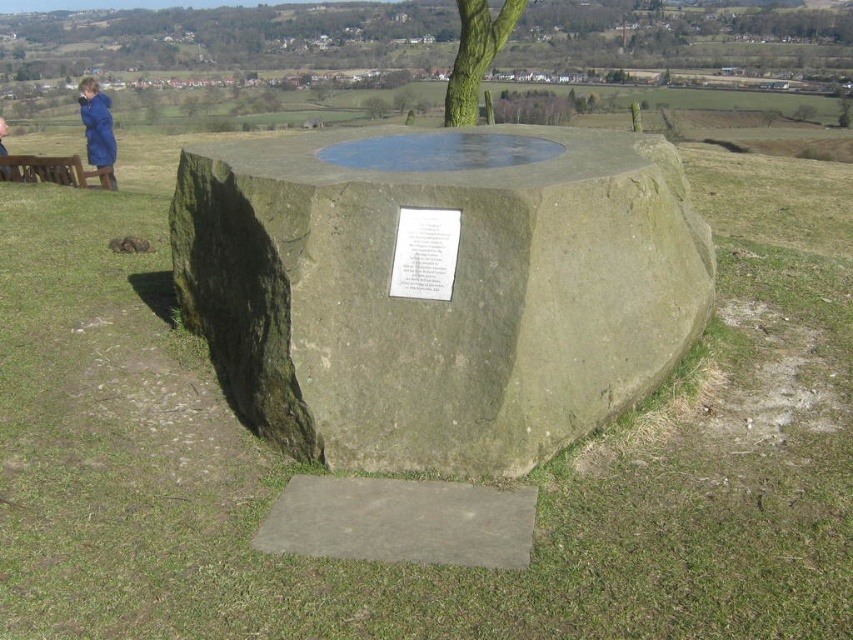
You are standing in front of the stone structure and want to take a photo of both the green textured tree at upper center and the blue fabric jacket at upper left. Which object should you adjust your camera focus on first to ensure both are in the frame?

The green textured tree at upper center is closer to the viewer than the blue fabric jacket at upper left, so you should focus on the green textured tree at upper center first to ensure both are in the frame.

You are standing at the point marked by the coordinates point (438, 288) in the image. What object are you directly facing?

You are directly facing the green stone monument at center, as the coordinates point (438, 288) corresponds to that object.

From the picture: You are standing at the base of the stone structure and want to walk towards the two points marked in the image. Which point, point (331, 224) or point (3, 140), is closer to you?

Point (331, 224) is closer to you because it is in front of point (3, 140).